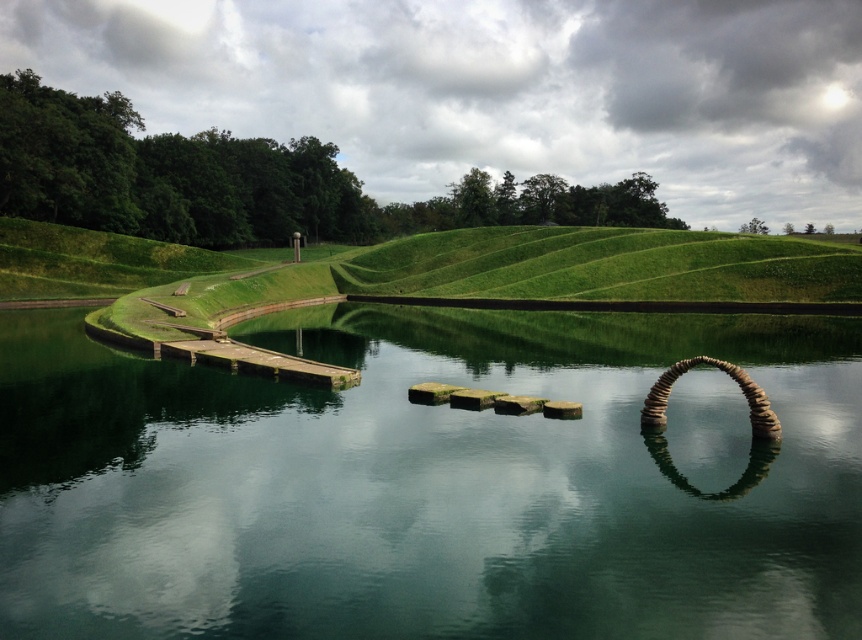
Question: Among these objects, which one is nearest to the camera?

Choices:
 (A) green reflective water at center
 (B) wooden pier at left

Answer: (A)

Question: Can you confirm if green reflective water at center is thinner than wooden pier at left?

Choices:
 (A) yes
 (B) no

Answer: (B)

Question: Which of the following is the farthest from the observer?

Choices:
 (A) wooden pier at left
 (B) green reflective water at center

Answer: (A)

Question: Is the position of green reflective water at center less distant than that of wooden pier at left?

Choices:
 (A) no
 (B) yes

Answer: (B)

Question: Can you confirm if green reflective water at center is positioned below wooden pier at left?

Choices:
 (A) yes
 (B) no

Answer: (B)